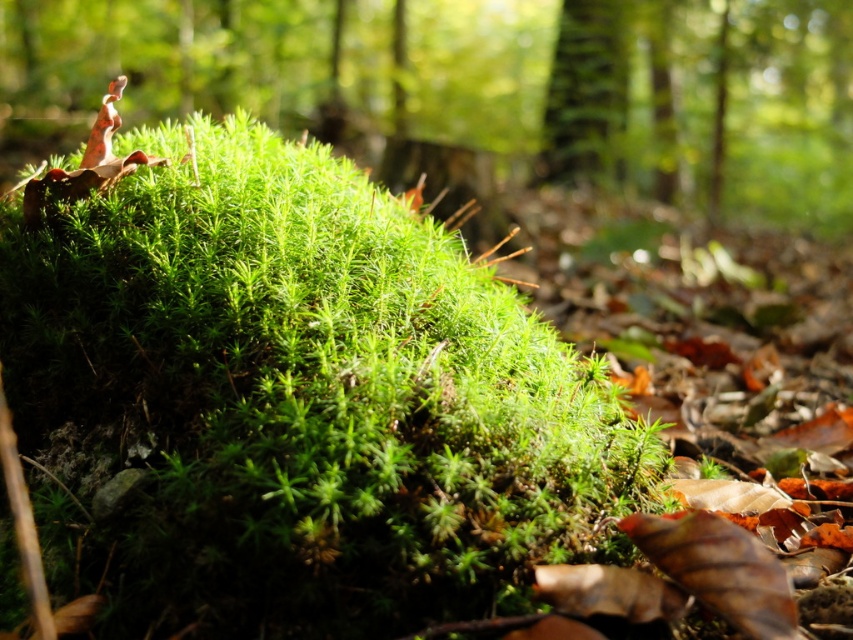
You are a photographer trying to capture the green fuzzy moss at center and the green textured bark at upper center in a single shot. Since the background is blurred, can you tell which object is closer to the camera?

The green fuzzy moss at center is closer to the camera because it is in front of the green textured bark at upper center, and the blurred background suggests a shallow depth of field focusing on the foreground elements.

In the scene shown: You are a botanist examining the green fuzzy moss at center and the green textured bark at upper center. Which of these two objects is taller?

The green fuzzy moss at center is taller than the green textured bark at upper center.

You are a photographer trying to capture the green fuzzy moss at center and the green textured bark at upper center in a single shot. Since the camera can only focus on one object clearly, which object should you focus on to ensure it takes up more space in the photo?

The green fuzzy moss at center is bigger than the green textured bark at upper center, so focusing on it will ensure it takes up more space in the photo.